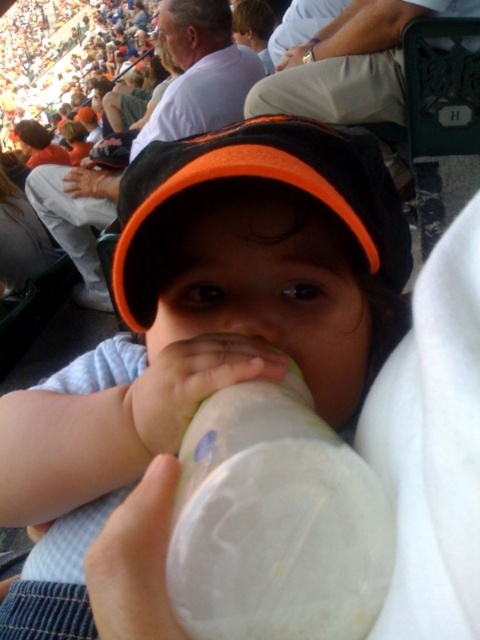
Consider the image. Is transparent plastic bottle at center below black fabric cap at center?

Indeed, transparent plastic bottle at center is positioned under black fabric cap at center.

Which is behind, point (371, 564) or point (214, 145)?

The point (214, 145) is more distant.

The height and width of the screenshot is (640, 480). What are the coordinates of `transparent plastic bottle at center` in the screenshot? It's located at (276, 522).

Does white plastic bottle at center have a smaller size compared to black fabric cap at center?

Incorrect, white plastic bottle at center is not smaller in size than black fabric cap at center.

Does point (347, 161) come in front of point (233, 170)?

No, (347, 161) is behind (233, 170).

The height and width of the screenshot is (640, 480). What do you see at coordinates (204, 326) in the screenshot? I see `white plastic bottle at center` at bounding box center [204, 326].

Locate an element on the screen. This screenshot has height=640, width=480. white plastic bottle at center is located at coordinates (204, 326).

Is white plastic bottle at center thinner than transparent plastic bottle at center?

No.

Does white plastic bottle at center have a larger size compared to transparent plastic bottle at center?

Correct, white plastic bottle at center is larger in size than transparent plastic bottle at center.

The width and height of the screenshot is (480, 640). In order to click on white plastic bottle at center in this screenshot , I will do `click(204, 326)`.